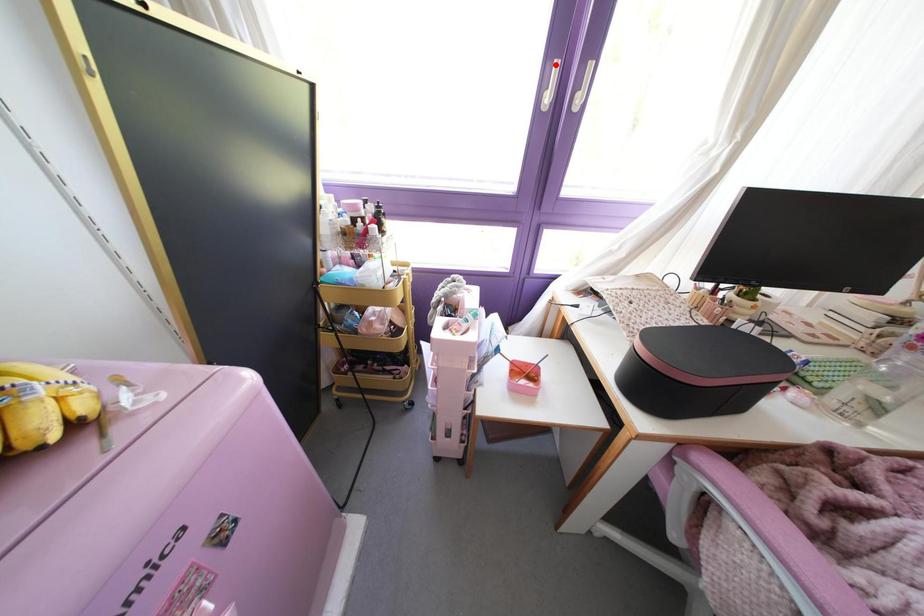
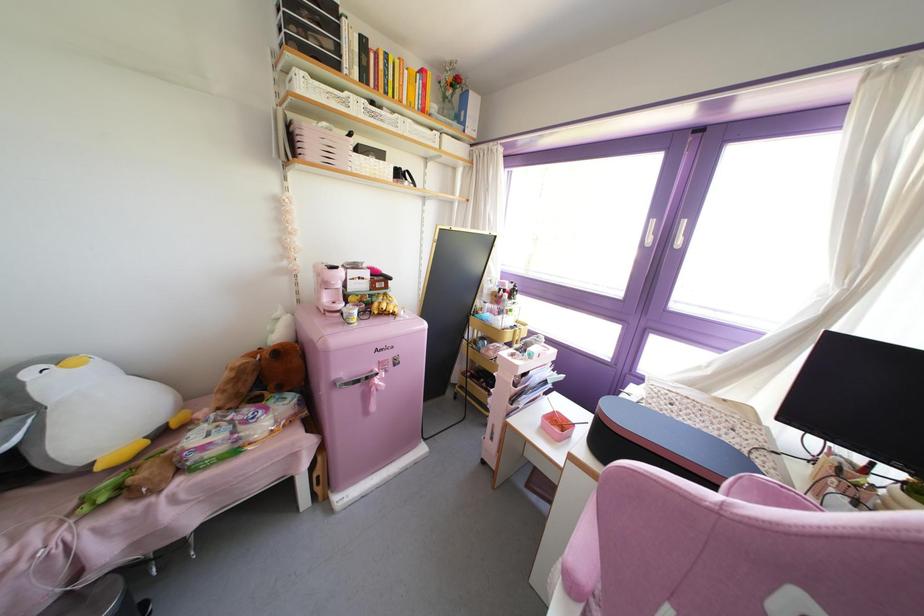
Locate, in the second image, the point that corresponds to the highlighted location in the first image.

(652, 222)